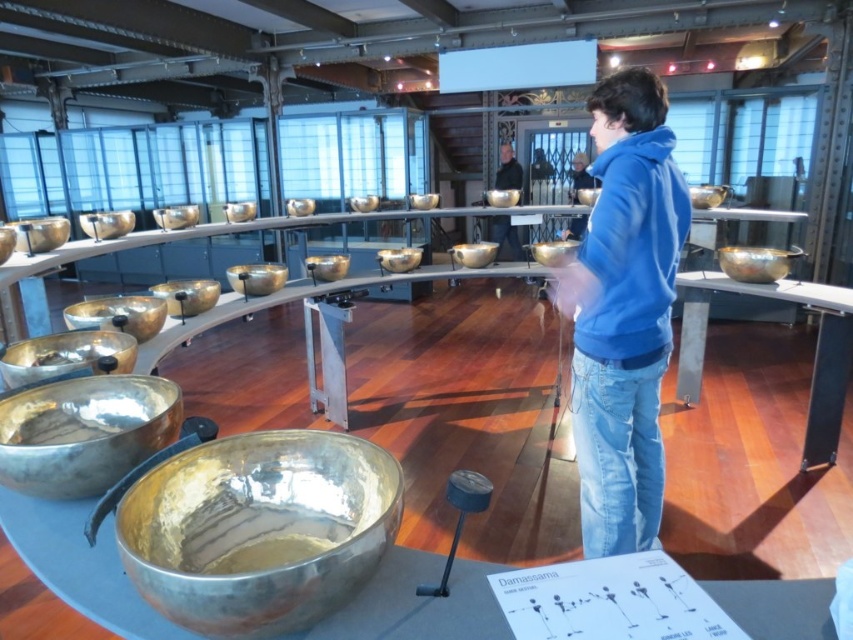
Is blue cotton hoodie at center taller than matte black jacket at center?

Indeed, blue cotton hoodie at center has a greater height compared to matte black jacket at center.

Which is more to the right, blue cotton hoodie at center or matte black jacket at center?

matte black jacket at center is more to the right.

Does point (660, 456) lie behind point (515, 250)?

No, (660, 456) is in front of (515, 250).

Where is `blue cotton hoodie at center`? This screenshot has height=640, width=853. blue cotton hoodie at center is located at coordinates (624, 312).